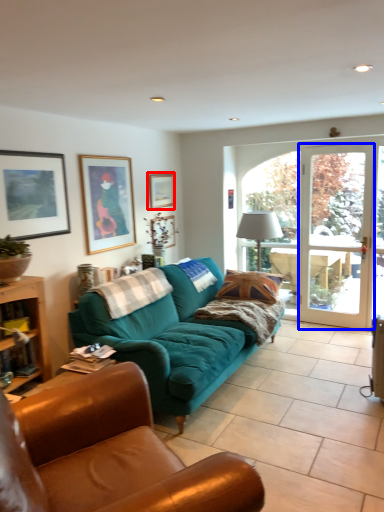
Question: Which object appears closest to the camera in this image, picture frame (highlighted by a red box) or screen door (highlighted by a blue box)?

Choices:
 (A) picture frame
 (B) screen door

Answer: (B)